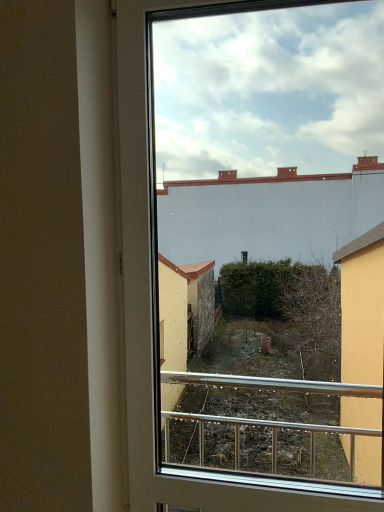
This screenshot has width=384, height=512. Describe the element at coordinates (152, 320) in the screenshot. I see `transparent glass window at center` at that location.

In order to face transparent glass window at center, should I rotate leftwards or rightwards?

You should look right and rotate roughly 6.960 degrees.

Locate an element on the screen. transparent glass window at center is located at coordinates tap(152, 320).

Locate an element on the screen. The height and width of the screenshot is (512, 384). transparent glass window at center is located at coordinates (152, 320).